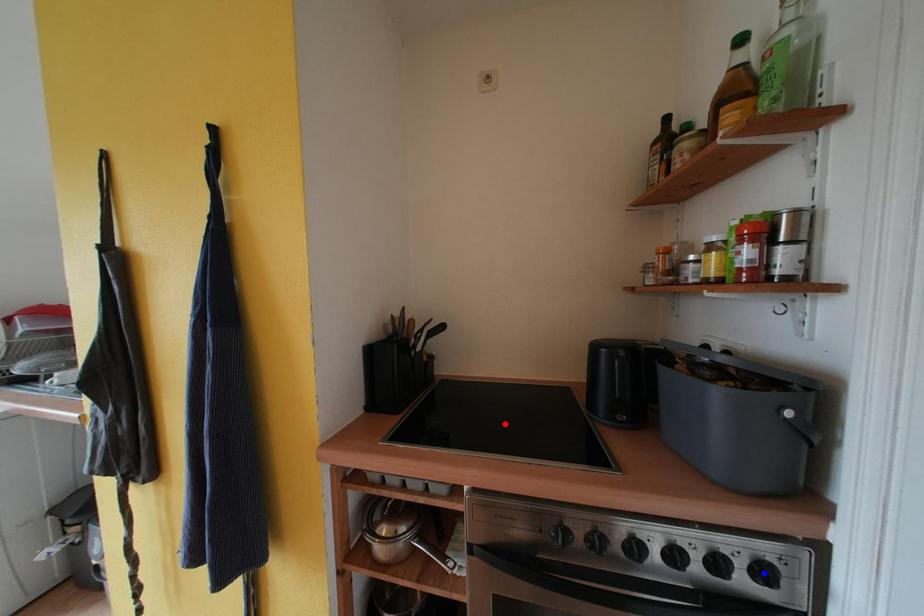
Question: In the image, two points are highlighted. Which point is nearer to the camera? Reply with the corresponding letter.

Choices:
 (A) blue point
 (B) red point

Answer: (A)